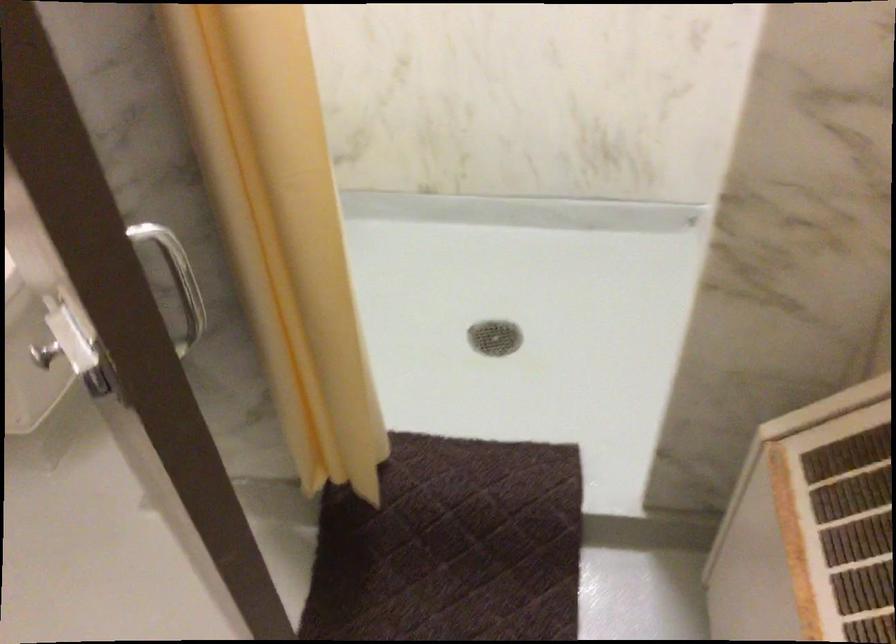
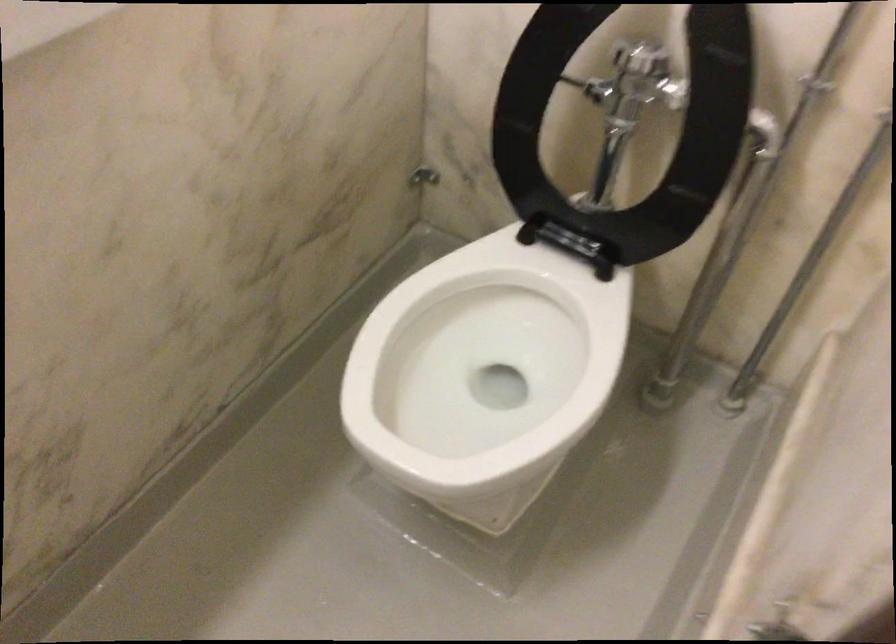
The images are taken continuously from a first-person perspective. In which direction are you moving?

The cameraman moved toward left, forward.